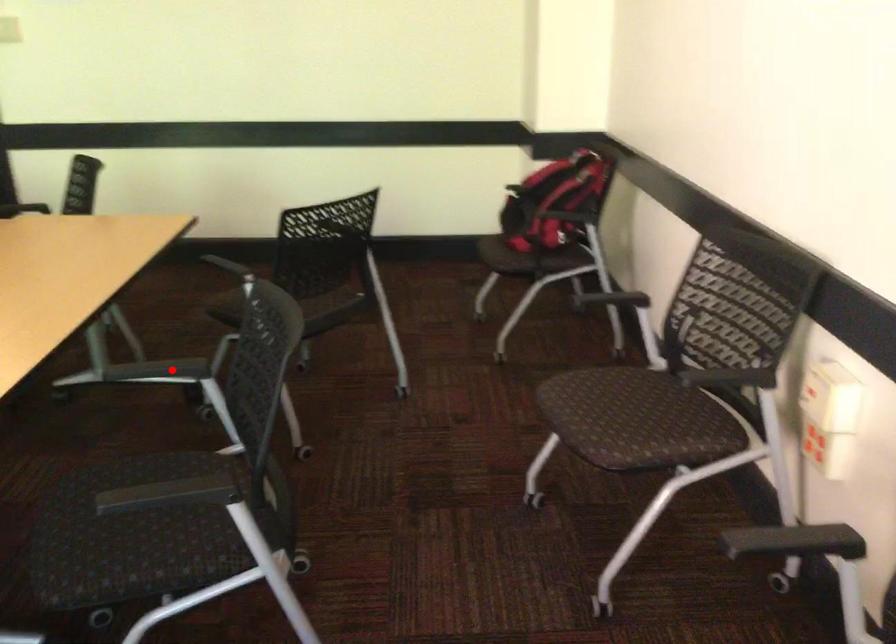
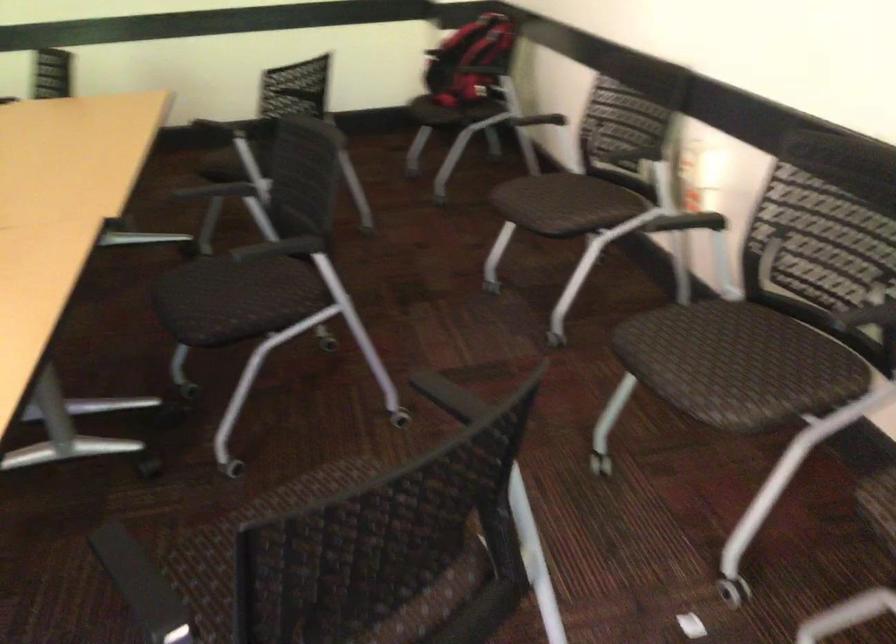
Question: I am providing you with two images of the same scene from different viewpoints. Image1 has a red point marked. In image2, the corresponding 3D location appears at what relative position? Reply with the corresponding letter.

Choices:
 (A) Closer
 (B) Farther

Answer: (B)